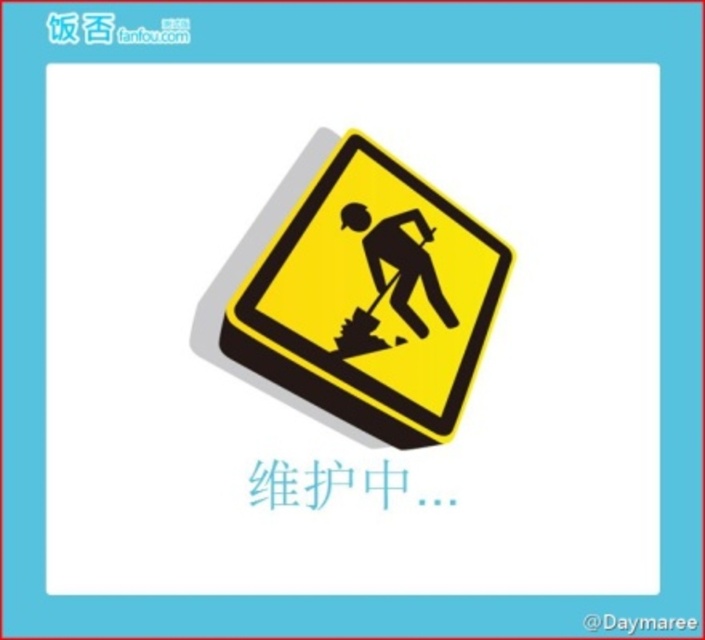
You are a pedestrian walking past the yellow matte sign at center and the black silhouette man at center. Which object is positioned higher in the image?

The black silhouette man at center is positioned higher than the yellow matte sign at center since the yellow matte sign at center is located below it.

You are a pedestrian passing by a construction site and see the yellow matte sign at center and the black silhouette man at center. Which object is bigger?

The yellow matte sign at center is larger in size than the black silhouette man at center.

You are a pedestrian approaching the yellow matte sign at center and the black silhouette man at center. Which object will you see first as you walk towards them?

The yellow matte sign at center will be seen first because it is closer to the viewer than the black silhouette man at center.